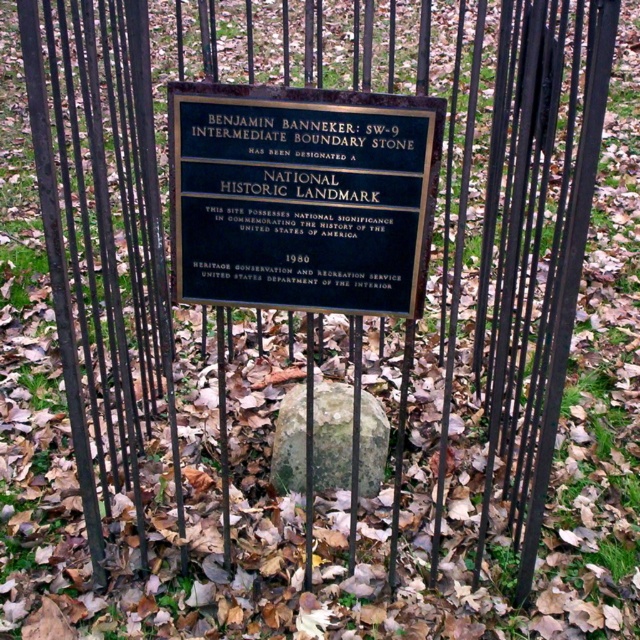
Question: Which of the following is the farthest from the observer?

Choices:
 (A) (381, 424)
 (B) (369, 113)

Answer: (A)

Question: Which object appears farthest from the camera in this image?

Choices:
 (A) gold/black plaque at center
 (B) green mossy rock at center

Answer: (B)

Question: Which point is closer to the camera taking this photo?

Choices:
 (A) (288, 403)
 (B) (412, 124)

Answer: (B)

Question: Can you confirm if gold/black plaque at center is positioned to the right of green mossy rock at center?

Choices:
 (A) no
 (B) yes

Answer: (A)

Question: Does gold/black plaque at center appear under green mossy rock at center?

Choices:
 (A) no
 (B) yes

Answer: (A)

Question: Does gold/black plaque at center come in front of green mossy rock at center?

Choices:
 (A) no
 (B) yes

Answer: (B)